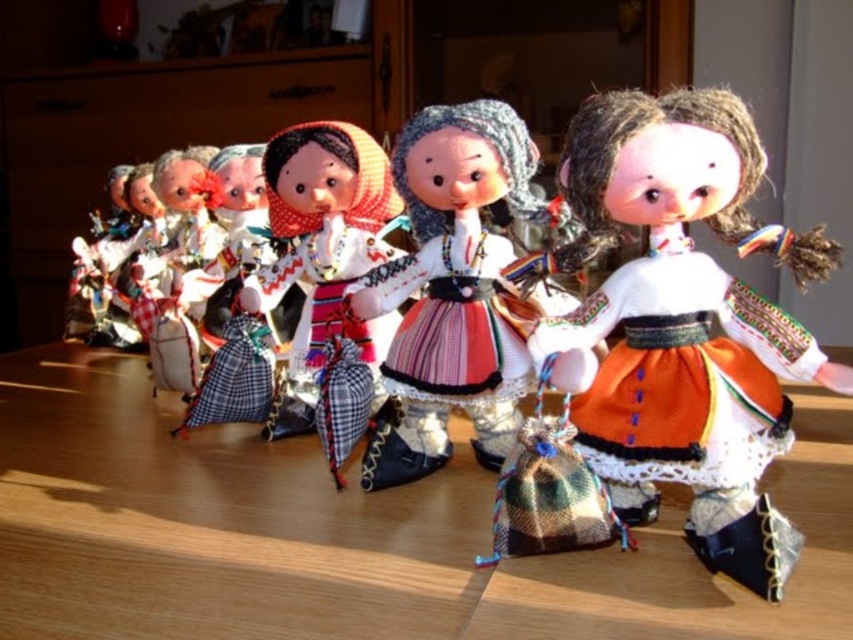
You are arranging a doll display and need to ensure the orange fabric skirt at center fits on the wooden table at center. Given that the skirt is 20 cm wide, what is the minimum width the table must have?

The wooden table at center is wider than the orange fabric skirt at center, so it can accommodate the skirt. Since the skirt is 20 cm wide, the table must be at least 20 cm wide to fit it.

You are a visitor at an exhibition and see the wooden table at center and the multicolored fabric dress at center. Which object takes up more space in the image?

The wooden table at center is larger in size than the multicolored fabric dress at center, so it takes up more space in the image.

You are arranging dolls on a wooden table at center and a multicolored fabric dress at center. Which object is more to the left?

The wooden table at center is positioned on the left side of multicolored fabric dress at center, so it is more to the left.